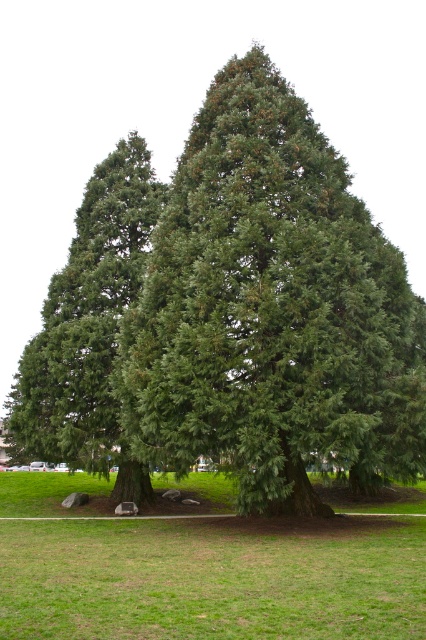
Question: Among these points, which one is farthest from the camera?

Choices:
 (A) (172, 202)
 (B) (250, 522)

Answer: (A)

Question: Which point is farther to the camera?

Choices:
 (A) green grass at center
 (B) green needle-like leaves at center

Answer: (B)

Question: Which point appears closest to the camera in this image?

Choices:
 (A) (141, 566)
 (B) (49, 352)
 (C) (288, 250)

Answer: (A)

Question: Is green needle-like leaves at center closer to camera compared to green grass at center?

Choices:
 (A) no
 (B) yes

Answer: (A)

Question: Can you confirm if green grass at center is positioned below green needle-like at left?

Choices:
 (A) yes
 (B) no

Answer: (A)

Question: Can you confirm if green needle-like leaves at center is thinner than green needle-like at left?

Choices:
 (A) no
 (B) yes

Answer: (A)